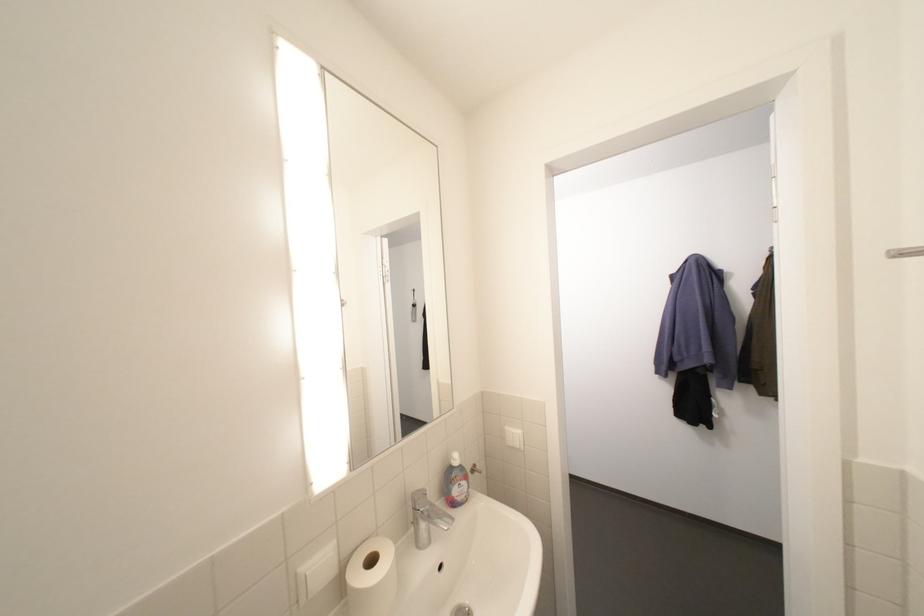
Locate an element on the screen. The width and height of the screenshot is (924, 616). white light switch is located at coordinates (514, 438).